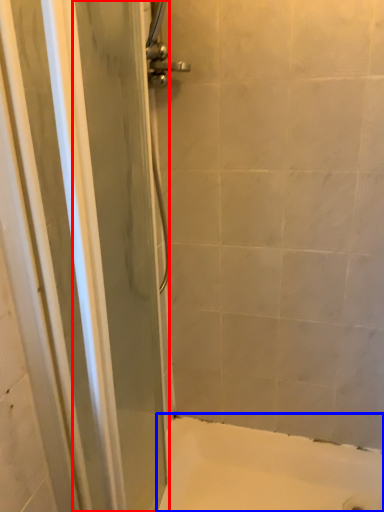
Question: Which of the following is the farthest to the observer, screen door (highlighted by a red box) or bath (highlighted by a blue box)?

Choices:
 (A) screen door
 (B) bath

Answer: (B)